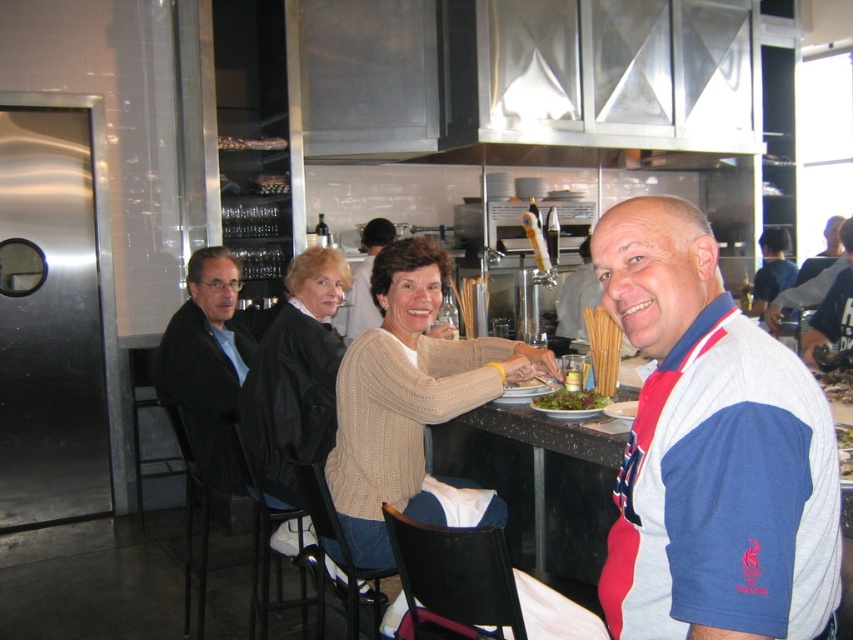
Looking at this image, does beige knitted sweater at center have a smaller size compared to green leafy salad at center?

No.

Does beige knitted sweater at center lie behind green leafy salad at center?

No, beige knitted sweater at center is in front of green leafy salad at center.

Find the location of `beige knitted sweater at center`. beige knitted sweater at center is located at coordinates (407, 396).

Image resolution: width=853 pixels, height=640 pixels. Identify the location of beige knitted sweater at center. (407, 396).

Between creamy knit sweater at center and blue and white polo shirt at right, which one is positioned higher?

blue and white polo shirt at right is higher up.

Which of these two, creamy knit sweater at center or blue and white polo shirt at right, stands taller?

With more height is creamy knit sweater at center.

Between point (326, 312) and point (840, 323), which one is positioned behind?

Positioned behind is point (840, 323).

Identify the location of creamy knit sweater at center. (294, 376).

Is white/red/blue fabric at right positioned in front of beige knitted sweater at center?

Yes, white/red/blue fabric at right is closer to the viewer.

Does point (601, 593) lie in front of point (492, 372)?

Yes, point (601, 593) is closer to viewer.

The height and width of the screenshot is (640, 853). I want to click on white/red/blue fabric at right, so click(x=712, y=451).